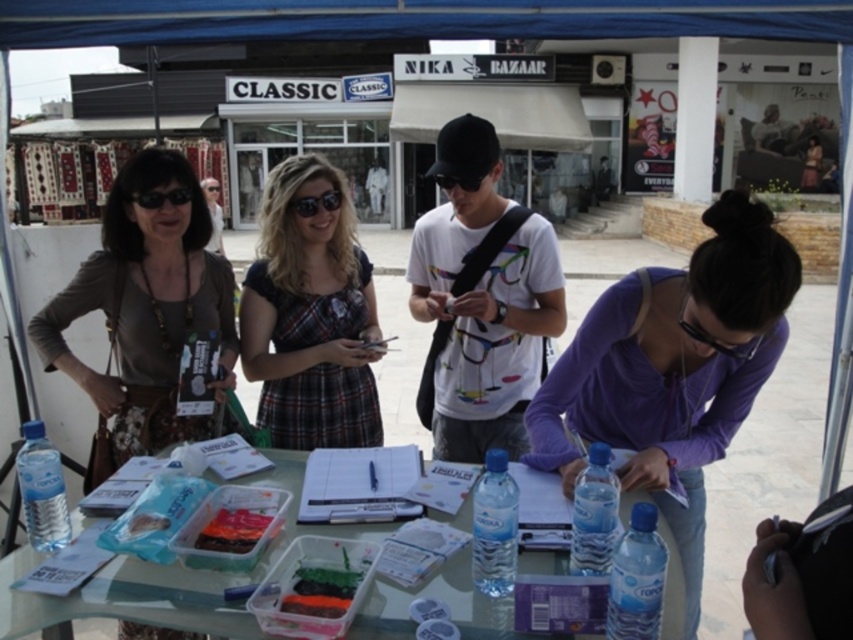
Question: Can you confirm if matte brown purse at left is wider than black matte goggles at center?

Choices:
 (A) yes
 (B) no

Answer: (A)

Question: Is white matte t-shirt at center bigger than plaid fabric dress at center?

Choices:
 (A) no
 (B) yes

Answer: (B)

Question: Is purple zip-up jacket at center positioned behind black plastic sunglasses at center?

Choices:
 (A) no
 (B) yes

Answer: (A)

Question: Estimate the real-world distances between objects in this image. Which object is farther from the transparent plastic goggles at lower right?

Choices:
 (A) purple zip-up jacket at center
 (B) matte brown purse at left
 (C) black plastic sunglasses at center

Answer: (B)

Question: Estimate the real-world distances between objects in this image. Which object is farther from the clear plastic table at center?

Choices:
 (A) clear plastic bottle at lower left
 (B) black matte goggles at upper left

Answer: (B)

Question: Which object appears farthest from the camera in this image?

Choices:
 (A) matte brown purse at left
 (B) blue fabric canopy at upper center
 (C) purple zip-up jacket at center

Answer: (A)